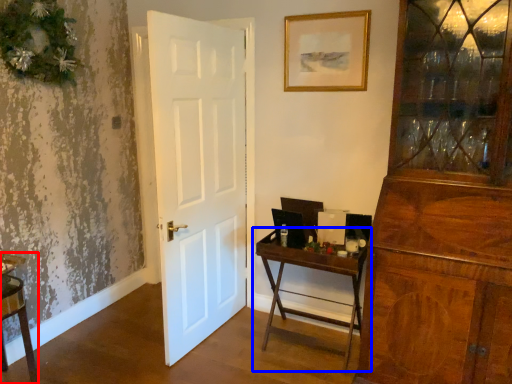
Question: Which object appears closest to the camera in this image, vanity (highlighted by a red box) or table (highlighted by a blue box)?

Choices:
 (A) vanity
 (B) table

Answer: (A)